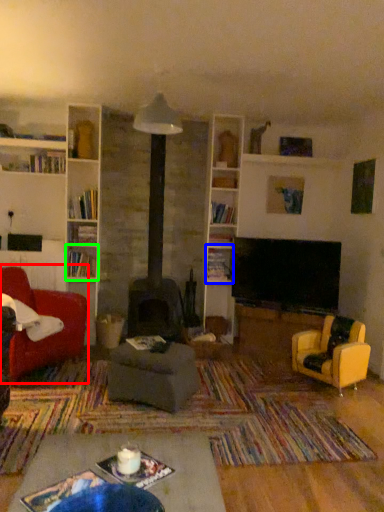
Question: Estimate the real-world distances between objects in this image. Which object is closer to chair (highlighted by a red box), shelf (highlighted by a blue box) or shelf (highlighted by a green box)?

Choices:
 (A) shelf
 (B) shelf

Answer: (B)